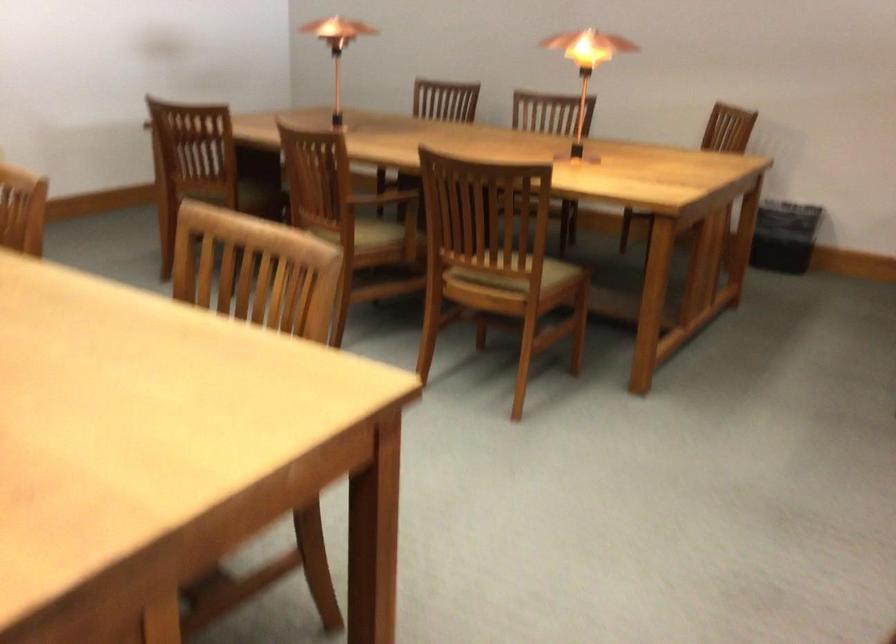
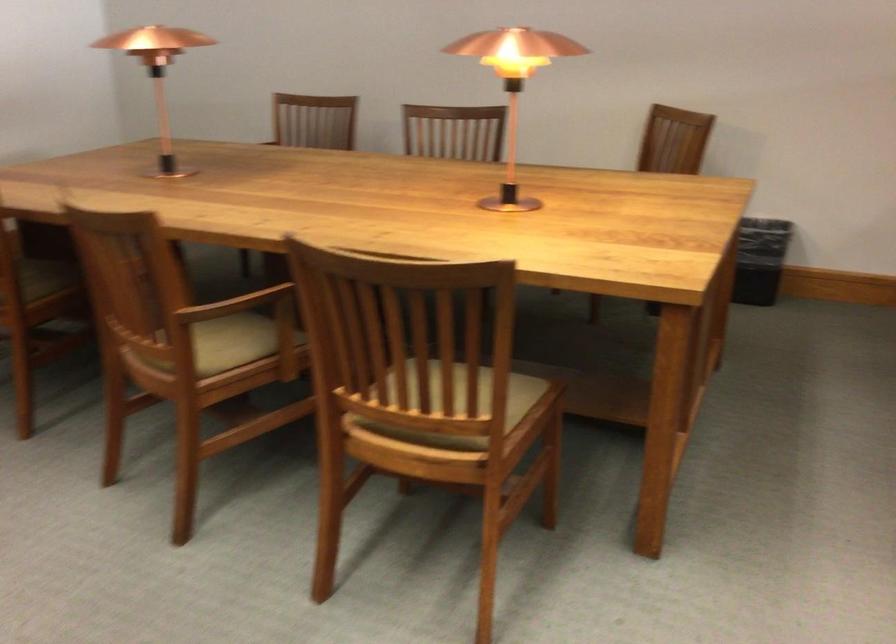
Where in the second image is the point corresponding to (x=383, y=194) from the first image?

(236, 304)